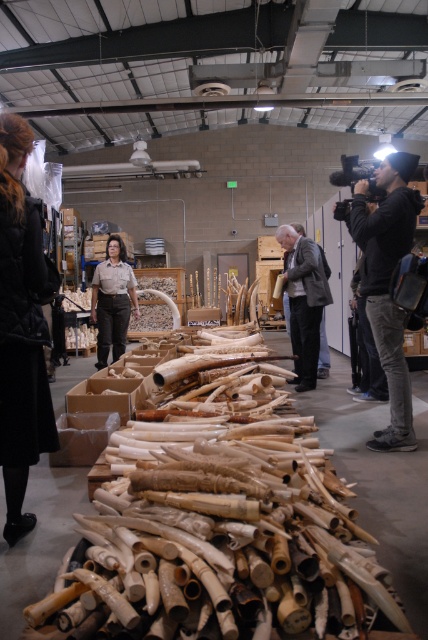
Who is shorter, black quilted coat at center or light brown wood at center?

light brown wood at center is shorter.

Is black quilted coat at center positioned before light brown wood at center?

Yes.

Is point (20, 257) positioned after point (312, 243)?

No, (20, 257) is in front of (312, 243).

Where is `black quilted coat at center`? The width and height of the screenshot is (428, 640). black quilted coat at center is located at coordinates (21, 326).

Is point (23, 528) in front of point (107, 316)?

Yes.

Where is `black quilted coat at center`? This screenshot has width=428, height=640. black quilted coat at center is located at coordinates (21, 326).

Does black quilted coat at center appear on the left side of black hoodie at upper right?

Correct, you'll find black quilted coat at center to the left of black hoodie at upper right.

This screenshot has height=640, width=428. In order to click on black quilted coat at center in this screenshot , I will do `click(21, 326)`.

This screenshot has width=428, height=640. Identify the location of black quilted coat at center. (21, 326).